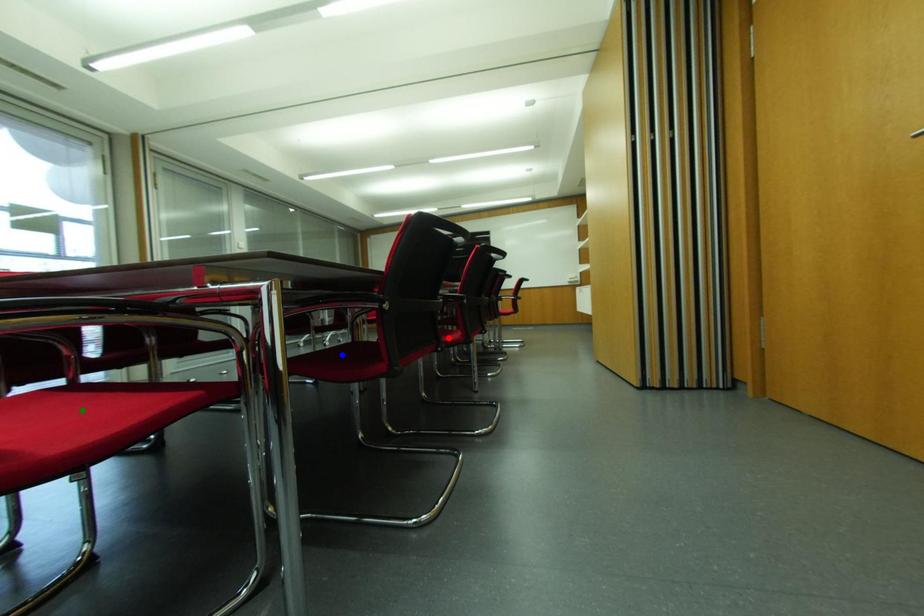
Order these from nearest to farthest:
- red point
- blue point
- green point

red point < blue point < green point